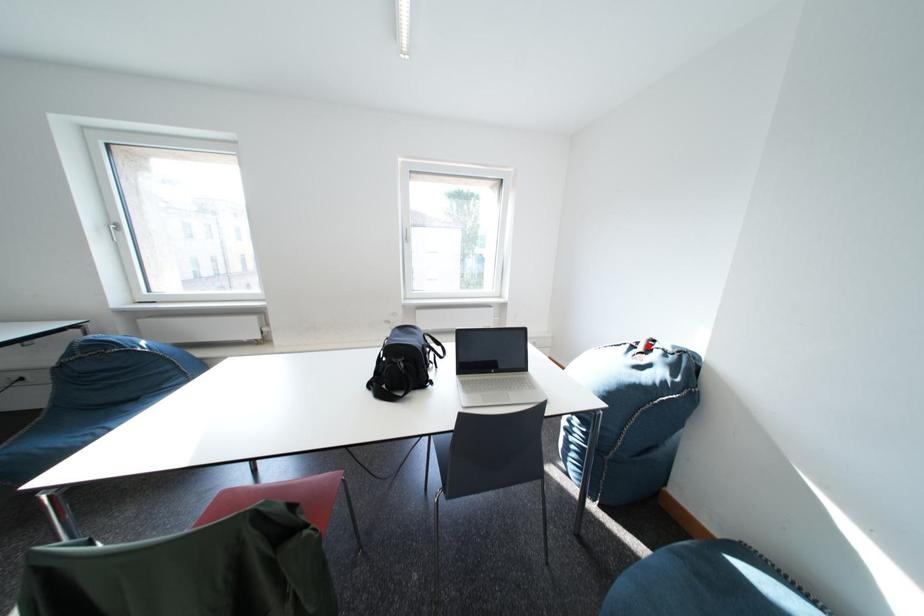
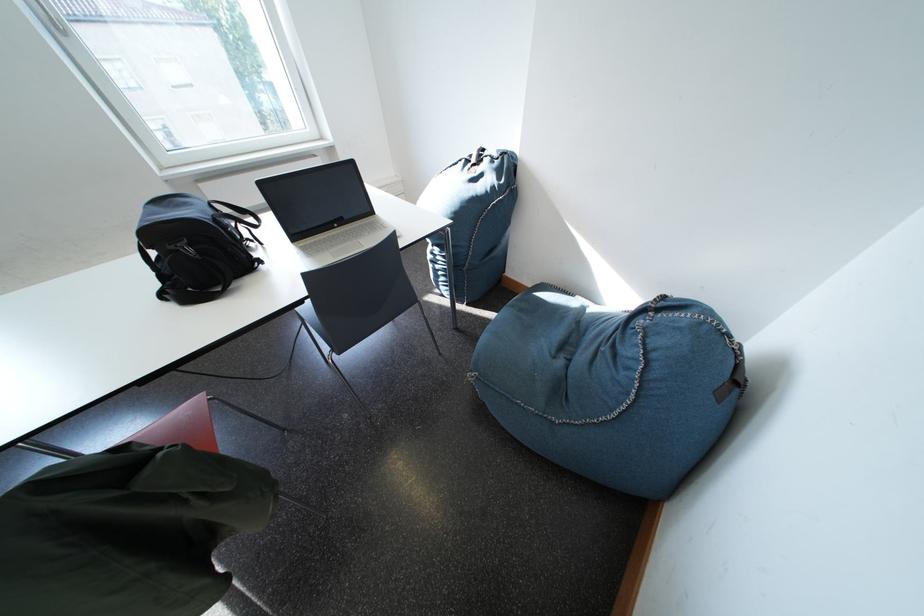
The point at the highlighted location is marked in the first image. Where is the corresponding point in the second image?

(481, 160)